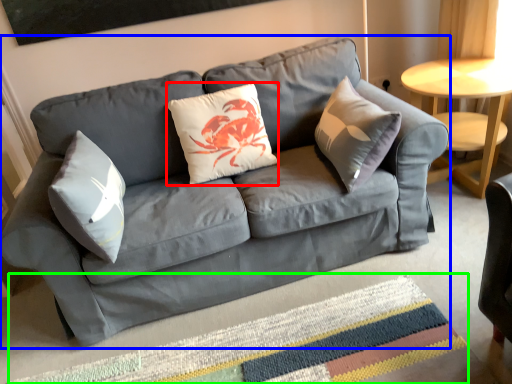
Question: Considering the real-world distances, which object is closest to pillow (highlighted by a red box)? studio couch (highlighted by a blue box) or mat (highlighted by a green box).

Choices:
 (A) studio couch
 (B) mat

Answer: (A)